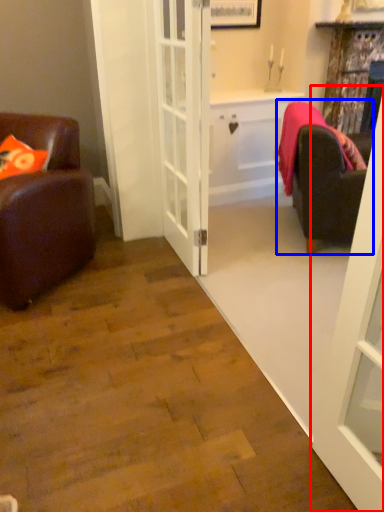
Question: Which point is further to the camera, door (highlighted by a red box) or studio couch (highlighted by a blue box)?

Choices:
 (A) door
 (B) studio couch

Answer: (B)